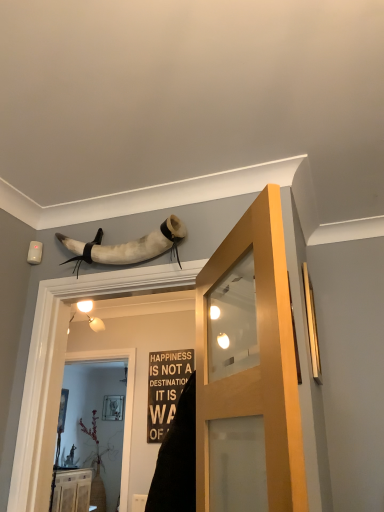
Question: Does gold metallic window at right appear on the right side of translucent glass screen door at center?

Choices:
 (A) no
 (B) yes

Answer: (B)

Question: Would you say gold metallic window at right is a long distance from translucent glass screen door at center?

Choices:
 (A) yes
 (B) no

Answer: (A)

Question: Is gold metallic window at right oriented towards translucent glass screen door at center?

Choices:
 (A) no
 (B) yes

Answer: (A)

Question: From the image's perspective, is gold metallic window at right located beneath translucent glass screen door at center?

Choices:
 (A) yes
 (B) no

Answer: (B)

Question: Does gold metallic window at right come in front of translucent glass screen door at center?

Choices:
 (A) yes
 (B) no

Answer: (A)

Question: Is matte wood door at center inside the boundaries of translucent glass screen door at center, or outside?

Choices:
 (A) outside
 (B) inside

Answer: (A)

Question: Considering the positions of matte wood door at center and translucent glass screen door at center in the image, is matte wood door at center wider or thinner than translucent glass screen door at center?

Choices:
 (A) wide
 (B) thin

Answer: (A)

Question: From the image's perspective, is matte wood door at center above or below translucent glass screen door at center?

Choices:
 (A) below
 (B) above

Answer: (B)

Question: Is matte wood door at center bigger or smaller than translucent glass screen door at center?

Choices:
 (A) small
 (B) big

Answer: (B)

Question: Relative to translucent glass screen door at center, is gold metallic window at right in front or behind?

Choices:
 (A) behind
 (B) front

Answer: (B)

Question: Is gold metallic window at right situated inside translucent glass screen door at center or outside?

Choices:
 (A) outside
 (B) inside

Answer: (A)

Question: Visually, is gold metallic window at right positioned to the left or to the right of translucent glass screen door at center?

Choices:
 (A) right
 (B) left

Answer: (A)

Question: From a real-world perspective, is gold metallic window at right above or below translucent glass screen door at center?

Choices:
 (A) below
 (B) above

Answer: (B)

Question: In terms of height, does light brown wood cabinet at lower left look taller or shorter compared to white leather horn at upper center?

Choices:
 (A) tall
 (B) short

Answer: (A)

Question: From a real-world perspective, is light brown wood cabinet at lower left positioned above or below white leather horn at upper center?

Choices:
 (A) below
 (B) above

Answer: (A)